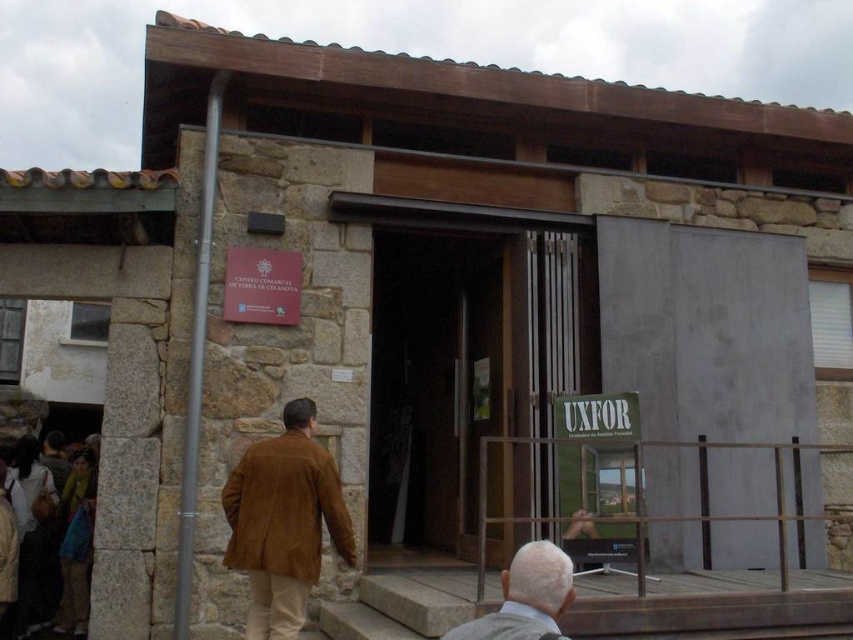
Question: Is suede brown jacket at left to the left of gray suede jacket at lower center from the viewer's perspective?

Choices:
 (A) yes
 (B) no

Answer: (A)

Question: Which of the following is the closest to the observer?

Choices:
 (A) suede brown jacket at left
 (B) dark wood door at center

Answer: (A)

Question: Is suede brown jacket at left thinner than gray suede jacket at lower center?

Choices:
 (A) no
 (B) yes

Answer: (A)

Question: Which object is closer to the camera taking this photo?

Choices:
 (A) dark wood door at center
 (B) gray suede jacket at lower center
 (C) suede brown jacket at left

Answer: (B)

Question: Which point is farther to the camera?

Choices:
 (A) (242, 476)
 (B) (480, 630)

Answer: (A)

Question: In this image, where is dark wood door at center located relative to gray suede jacket at lower center?

Choices:
 (A) right
 (B) left

Answer: (B)